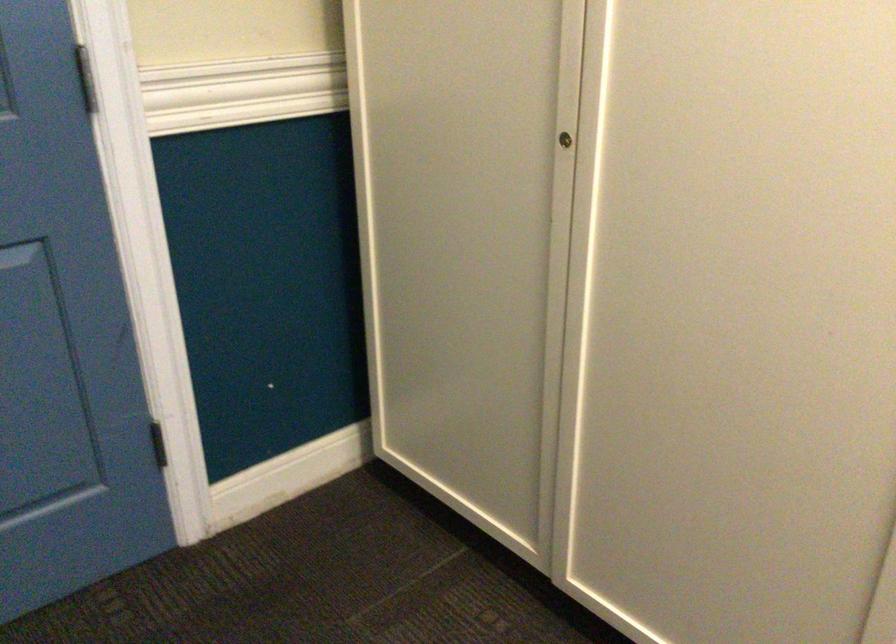
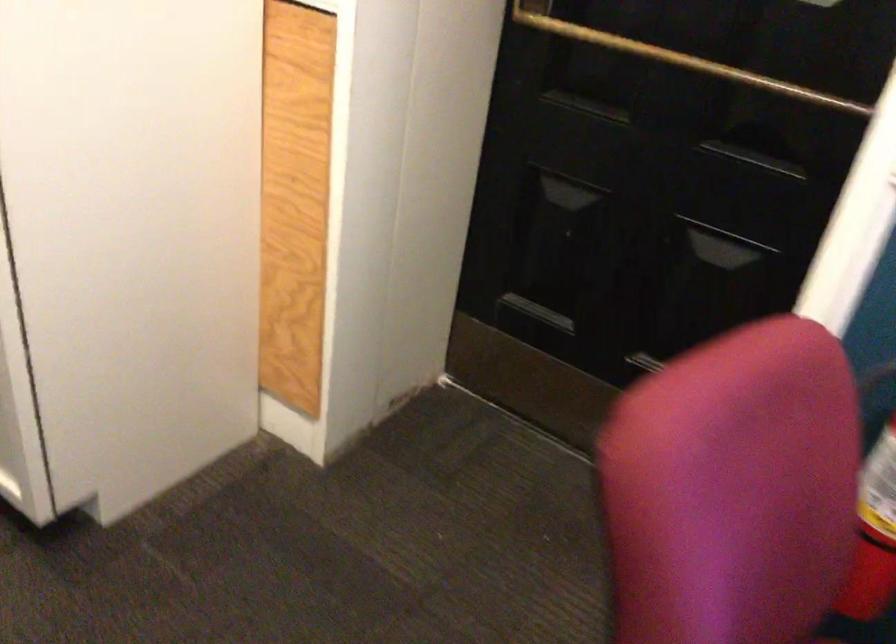
Question: Based on the continuous images, in which direction is the camera rotating? Reply with the corresponding letter.

Choices:
 (A) Left
 (B) Right
 (C) Up
 (D) Down

Answer: (B)